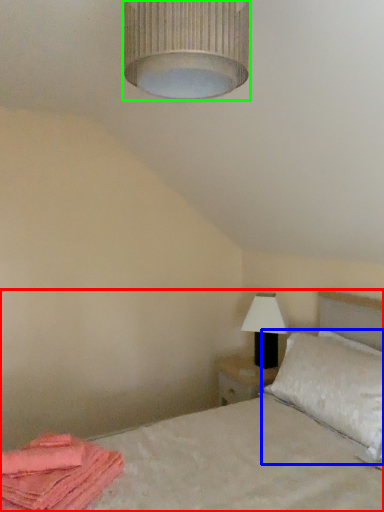
Question: Considering the real-world distances, which object is farthest from bed (highlighted by a red box)? pillow (highlighted by a blue box) or lamp (highlighted by a green box)?

Choices:
 (A) pillow
 (B) lamp

Answer: (B)